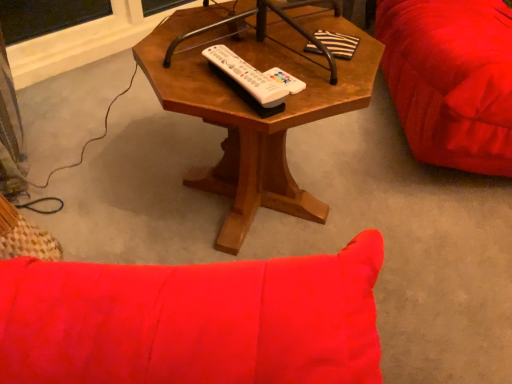
Question: Can you see white plastic remote at center touching wooden hexagonal table at center?

Choices:
 (A) yes
 (B) no

Answer: (B)

Question: Considering the relative sizes of white plastic remote at center and wooden hexagonal table at center in the image provided, is white plastic remote at center taller than wooden hexagonal table at center?

Choices:
 (A) yes
 (B) no

Answer: (B)

Question: Does white plastic remote at center turn towards wooden hexagonal table at center?

Choices:
 (A) no
 (B) yes

Answer: (B)

Question: Are white plastic remote at center and wooden hexagonal table at center far apart?

Choices:
 (A) yes
 (B) no

Answer: (B)

Question: Considering the relative positions of white plastic remote at center and wooden hexagonal table at center in the image provided, is white plastic remote at center behind wooden hexagonal table at center?

Choices:
 (A) yes
 (B) no

Answer: (A)

Question: Can you confirm if white plastic remote at center is positioned to the left of wooden hexagonal table at center?

Choices:
 (A) yes
 (B) no

Answer: (A)

Question: From a real-world perspective, is wooden hexagonal table at center below white plastic remote at center?

Choices:
 (A) yes
 (B) no

Answer: (A)

Question: Is wooden hexagonal table at center turned away from white plastic remote at center?

Choices:
 (A) no
 (B) yes

Answer: (A)

Question: From the image's perspective, is wooden hexagonal table at center on top of white plastic remote at center?

Choices:
 (A) yes
 (B) no

Answer: (B)

Question: From a real-world perspective, is wooden hexagonal table at center physically above white plastic remote at center?

Choices:
 (A) no
 (B) yes

Answer: (A)

Question: Is wooden hexagonal table at center shorter than white plastic remote at center?

Choices:
 (A) yes
 (B) no

Answer: (B)

Question: Does wooden hexagonal table at center lie behind white plastic remote at center?

Choices:
 (A) yes
 (B) no

Answer: (B)

Question: From the image's perspective, is white plastic remote at center located above or below wooden hexagonal table at center?

Choices:
 (A) below
 (B) above

Answer: (B)